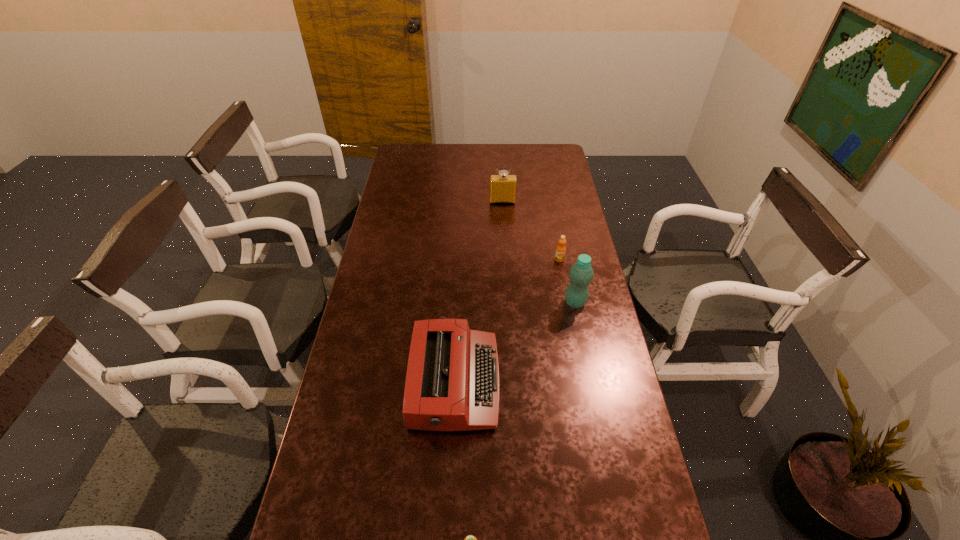
Where is `water bottle`? This screenshot has width=960, height=540. water bottle is located at coordinates click(581, 273).

Identify the location of the tallest object. The image size is (960, 540). (581, 273).

Locate an element on the screen. The height and width of the screenshot is (540, 960). the fourth shortest object is located at coordinates (503, 187).

At what (x,y) coordinates should I click in order to perform the action: click on the farthest object. Please return your answer as a coordinate pair (x, y). Image resolution: width=960 pixels, height=540 pixels. Looking at the image, I should click on (503, 187).

The height and width of the screenshot is (540, 960). Find the location of `the farther orange juice`. the farther orange juice is located at coordinates (x=561, y=249).

This screenshot has height=540, width=960. Find the location of `the second farthest object`. the second farthest object is located at coordinates (561, 249).

At what (x,y) coordinates should I click in order to perform the action: click on typewriter. Please return your answer as a coordinate pair (x, y). Looking at the image, I should click on (452, 382).

Locate an element on the screen. Image resolution: width=960 pixels, height=540 pixels. free region located 0.140m at the front cap of the third farthest object is located at coordinates click(x=523, y=302).

What are the coordinates of `free region located 0.060m at the front cap of the third farthest object` in the screenshot? It's located at (546, 302).

Image resolution: width=960 pixels, height=540 pixels. Identify the location of vacant space positioned 0.110m at the front cap of the third farthest object. (532, 302).